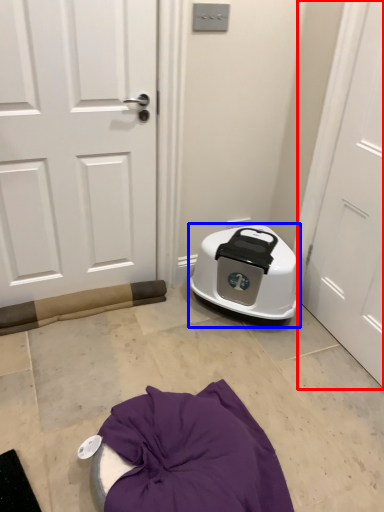
Question: Among these objects, which one is nearest to the camera, door (highlighted by a red box) or appliance (highlighted by a blue box)?

Choices:
 (A) door
 (B) appliance

Answer: (A)